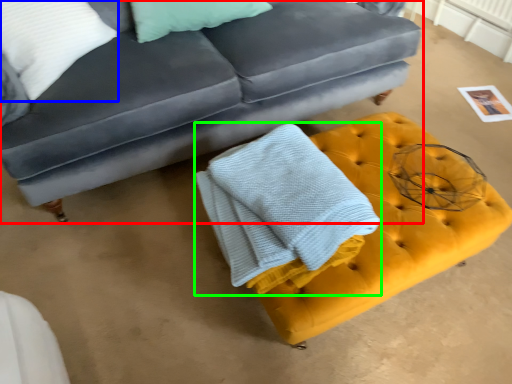
Question: Which is nearer to the studio couch (highlighted by a red box)? pillow (highlighted by a blue box) or bath towel (highlighted by a green box).

Choices:
 (A) pillow
 (B) bath towel

Answer: (A)